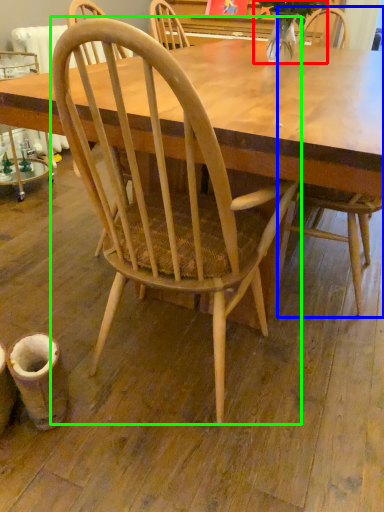
Question: Which is nearer to the plant (highlighted by a red box)? chair (highlighted by a blue box) or chair (highlighted by a green box).

Choices:
 (A) chair
 (B) chair

Answer: (A)